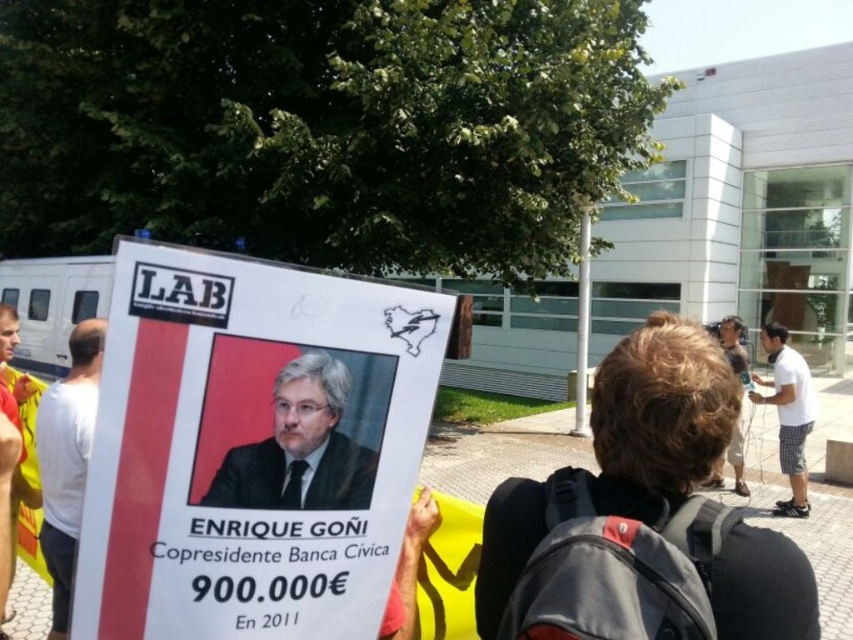
Who is positioned more to the left, white paper poster at center or light brown hair at right?

Positioned to the left is white paper poster at center.

Who is more distant from viewer, [244,561] or [729,323]?

The point [729,323] is behind.

Image resolution: width=853 pixels, height=640 pixels. Find the location of `white paper poster at center`. white paper poster at center is located at coordinates (252, 448).

Does white paper poster at center have a greater width compared to white t-shirt at left?

Incorrect, white paper poster at center's width does not surpass white t-shirt at left's.

This screenshot has width=853, height=640. Identify the location of white paper poster at center. pyautogui.click(x=252, y=448).

Describe the element at coordinates (252, 448) in the screenshot. The image size is (853, 640). I see `white paper poster at center` at that location.

Where is `white paper poster at center`? white paper poster at center is located at coordinates (252, 448).

Measure the distance between point (288, 333) and camera.

Point (288, 333) and camera are 1.08 meters apart from each other.

Between point (318, 580) and point (287, 465), which one is positioned in front?

Point (287, 465) is more forward.

Where is `white paper poster at center`? The image size is (853, 640). white paper poster at center is located at coordinates (252, 448).